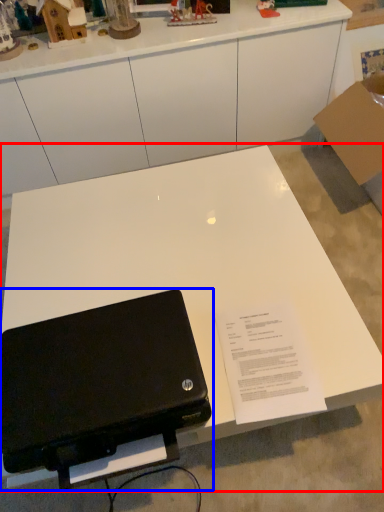
Question: Which point is closer to the camera, table (highlighted by a red box) or laptop (highlighted by a blue box)?

Choices:
 (A) table
 (B) laptop

Answer: (B)